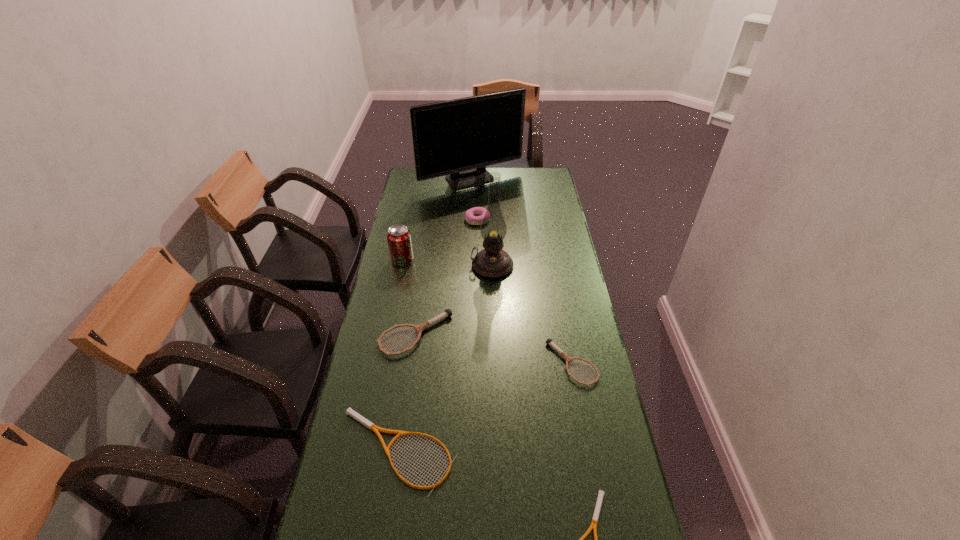
The width and height of the screenshot is (960, 540). Identify the location of free space between the soda can and the third shortest tennis racket. [x=488, y=312].

Where is `vacant area between the bigger gray tennis racket and the pink pastry`? vacant area between the bigger gray tennis racket and the pink pastry is located at coordinates (446, 277).

Find the location of a particular element. object that is the sixth nearest to the seventh tallest object is located at coordinates (474, 216).

Locate an element on the screen. The image size is (960, 540). the sixth closest object to the farthest object is located at coordinates (349, 411).

Locate which tennis racket ranks fourth in proximity to the third tallest object. Please provide its 2D coordinates. Your answer should be formatted as a tuple, i.e. [(x, y)], where the tuple contains the x and y coordinates of a point satisfying the conditions above.

[(601, 493)]

Select which tennis racket appears as the fourth closest to the sixth shortest object. Please provide its 2D coordinates. Your answer should be formatted as a tuple, i.e. [(x, y)], where the tuple contains the x and y coordinates of a point satisfying the conditions above.

[(601, 493)]

Where is `beige tennis racket that is the closest to the fifth tallest object`? This screenshot has width=960, height=540. beige tennis racket that is the closest to the fifth tallest object is located at coordinates tap(349, 411).

In order to click on the second closest beige tennis racket relative to the right gray tennis racket in this screenshot , I will do `click(601, 493)`.

Locate an element on the screen. vacant space that satisfies the following two spatial constraints: 1. on the front side of the fifth tallest object; 2. on the right side of the soda can is located at coordinates (387, 335).

Find the location of a particular element. The image size is (960, 540). free region that satisfies the following two spatial constraints: 1. on the back side of the fifth tallest object; 2. on the left side of the second shortest object is located at coordinates (415, 335).